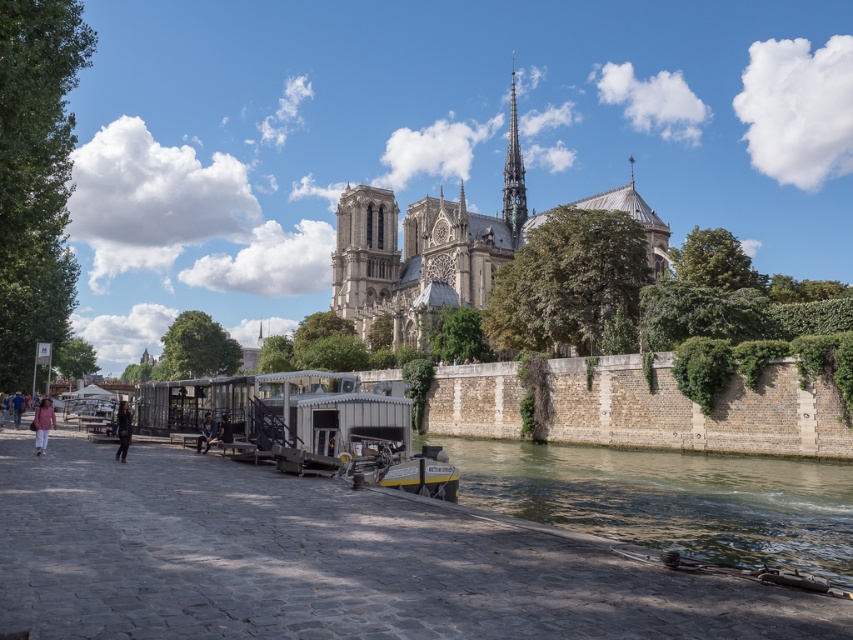
Which of these two, light brown wooden bench at center or pink fabric person at lower left, stands shorter?

Standing shorter between the two is light brown wooden bench at center.

Does point (224, 429) come in front of point (10, 410)?

Yes, it is.

Where is `light brown wooden bench at center`? The image size is (853, 640). light brown wooden bench at center is located at coordinates (219, 433).

What do you see at coordinates (514, 177) in the screenshot? I see `green glass spire at upper center` at bounding box center [514, 177].

Can you confirm if green glass spire at upper center is positioned above pink fabric jacket at lower left?

Yes.

This screenshot has height=640, width=853. I want to click on green glass spire at upper center, so click(x=514, y=177).

You are a GUI agent. You are given a task and a screenshot of the screen. Output one action in this format:
    pyautogui.click(x=<x>, y=<y>)
    Task: Click on the green glass spire at upper center
    The height and width of the screenshot is (640, 853).
    Given the screenshot: What is the action you would take?
    pyautogui.click(x=514, y=177)

Is point (422, 214) closer to viewer compared to point (524, 193)?

No, it is behind (524, 193).

Is point (357, 186) positioned in front of point (520, 205)?

No, (357, 186) is further to viewer.

In order to click on stone gothic cathedral at center in this screenshot , I will do `click(424, 250)`.